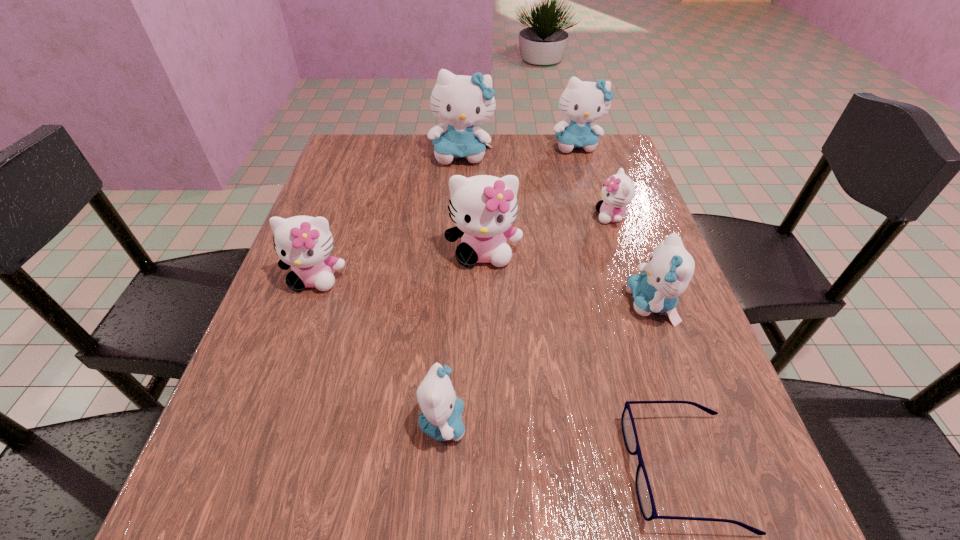
Find the location of a particular element. This screenshot has width=960, height=540. free space located on the front-facing side of the third farthest object is located at coordinates (458, 217).

You are a GUI agent. You are given a task and a screenshot of the screen. Output one action in this format:
    pyautogui.click(x=<x>, y=<y>)
    Task: Click on the free space located 0.310m on the front-facing side of the third farthest object
    
    Given the screenshot: What is the action you would take?
    pyautogui.click(x=466, y=217)

Where is `vacant space located 0.300m on the face of the nearest blue kitten`? The height and width of the screenshot is (540, 960). vacant space located 0.300m on the face of the nearest blue kitten is located at coordinates (656, 422).

This screenshot has height=540, width=960. In order to click on vacant space located on the front-facing side of the shortest object in this screenshot , I will do `click(582, 470)`.

The height and width of the screenshot is (540, 960). What are the coordinates of `vacant region located 0.300m on the front-facing side of the shortest object` in the screenshot? It's located at (424, 470).

Locate an element on the screen. Image resolution: width=960 pixels, height=540 pixels. free space located 0.360m on the front-facing side of the shortest object is located at coordinates (383, 470).

Image resolution: width=960 pixels, height=540 pixels. I want to click on object that is at the near edge, so click(644, 493).

The height and width of the screenshot is (540, 960). Identify the location of object at the left edge. (303, 242).

What are the coordinates of `spectacles present at the right edge` in the screenshot? It's located at (644, 493).

Where is `object at the far right corner`? The image size is (960, 540). object at the far right corner is located at coordinates (582, 101).